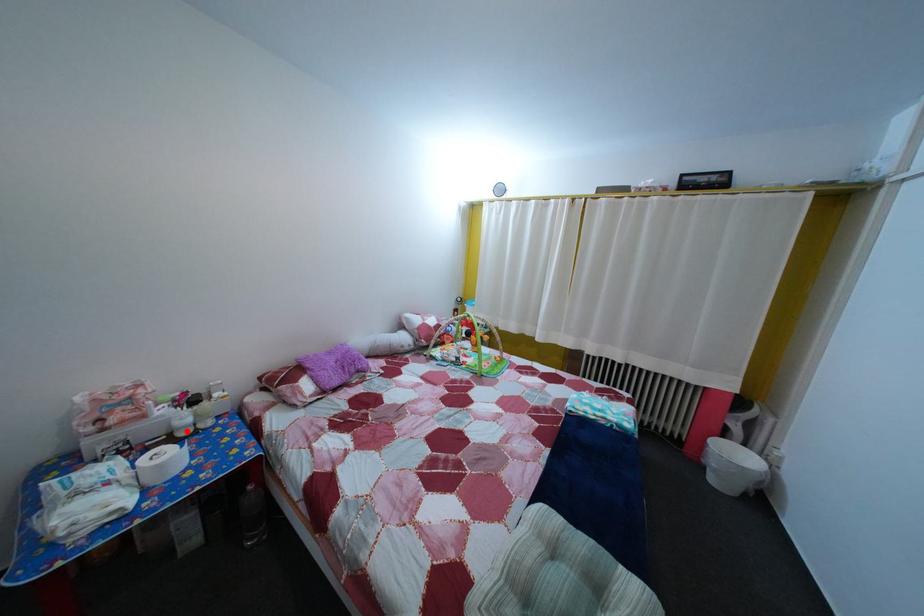
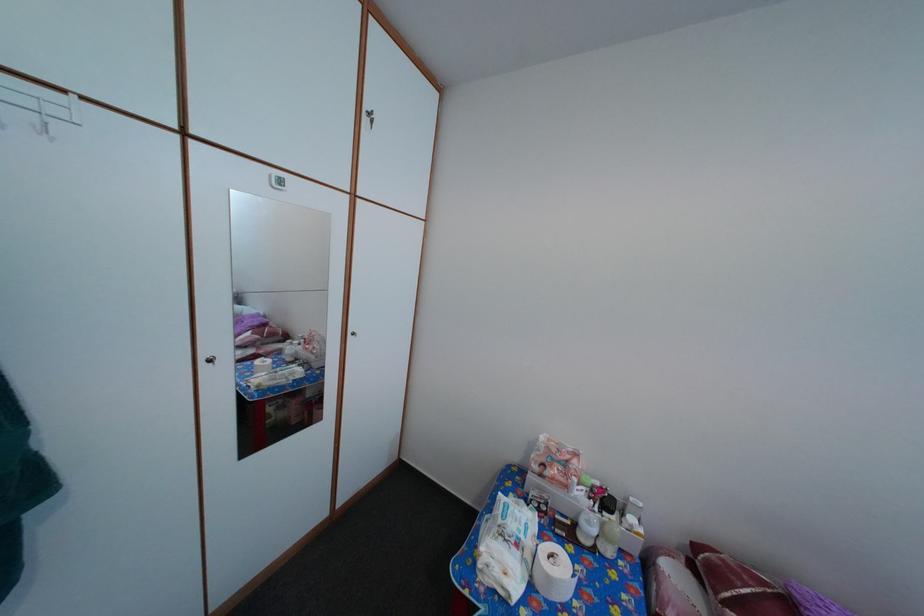
Question: I am providing you with two images of the same scene from different viewpoints. A red point is shown in image1. For the corresponding object point in image2, is it positioned nearer or farther from the camera?

Choices:
 (A) Nearer
 (B) Farther

Answer: (B)